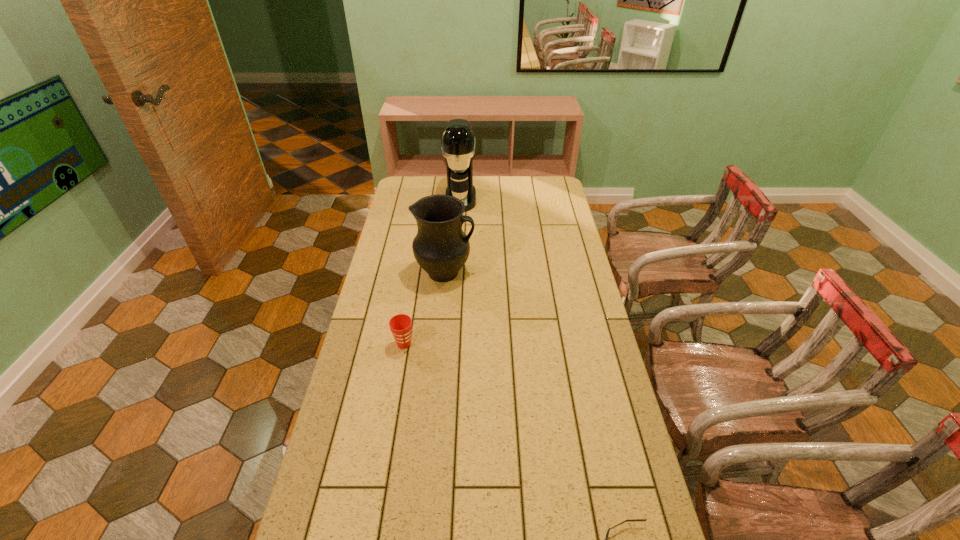
The width and height of the screenshot is (960, 540). Find the location of `object that is at the left edge`. object that is at the left edge is located at coordinates (400, 325).

Identify the location of free space at the far edge of the desktop. (491, 185).

Where is `vacant space at the left edge of the desktop`? This screenshot has height=540, width=960. vacant space at the left edge of the desktop is located at coordinates (324, 461).

Image resolution: width=960 pixels, height=540 pixels. In order to click on free spot at the right edge of the desktop in this screenshot , I will do `click(560, 330)`.

In the image, there is a desktop. Where is `vacant space at the far left corner`? Image resolution: width=960 pixels, height=540 pixels. vacant space at the far left corner is located at coordinates (412, 194).

Where is `vacant region at the far right corner of the desktop`? Image resolution: width=960 pixels, height=540 pixels. vacant region at the far right corner of the desktop is located at coordinates (538, 192).

Find the location of a particular element. Image resolution: width=960 pixels, height=540 pixels. empty space between the pitcher and the cup is located at coordinates (424, 308).

Locate an element on the screen. unoccupied area between the third tallest object and the second tallest object is located at coordinates (424, 308).

Identify the location of vacant space that is in between the second farthest object and the cup. This screenshot has width=960, height=540. (424, 308).

The image size is (960, 540). Find the location of `free space between the pitcher and the third farthest object`. free space between the pitcher and the third farthest object is located at coordinates 424,308.